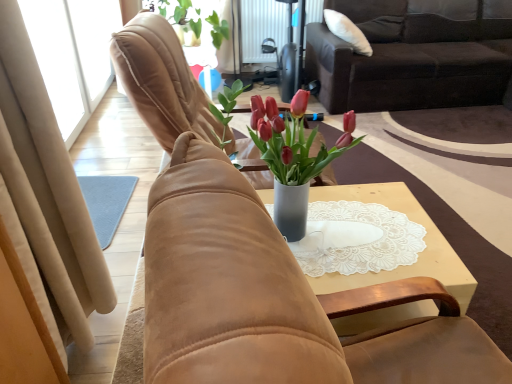
Question: Considering the positions of point (249, 6) and point (399, 188), is point (249, 6) closer or farther from the camera than point (399, 188)?

Choices:
 (A) closer
 (B) farther

Answer: (B)

Question: Based on their sizes in the image, would you say metallic radiator at upper center is bigger or smaller than white lace doily at center?

Choices:
 (A) big
 (B) small

Answer: (B)

Question: Based on their relative distances, which object is nearer to the green matte plant at upper center?

Choices:
 (A) dark brown fabric couch at upper right
 (B) suede chair at center, which is the 2th chair from front to back
 (C) metallic radiator at upper center
 (D) beige suede curtain at left
 (E) suede chair at center, positioned as the 1th chair in front-to-back order

Answer: (C)

Question: Which object is the farthest from the suede chair at center, positioned as the 1th chair in front-to-back order?

Choices:
 (A) metallic radiator at upper center
 (B) beige suede curtain at left
 (C) suede chair at center, the 1th chair in the back-to-front sequence
 (D) green matte plant at upper center
 (E) dark brown fabric couch at upper right

Answer: (A)